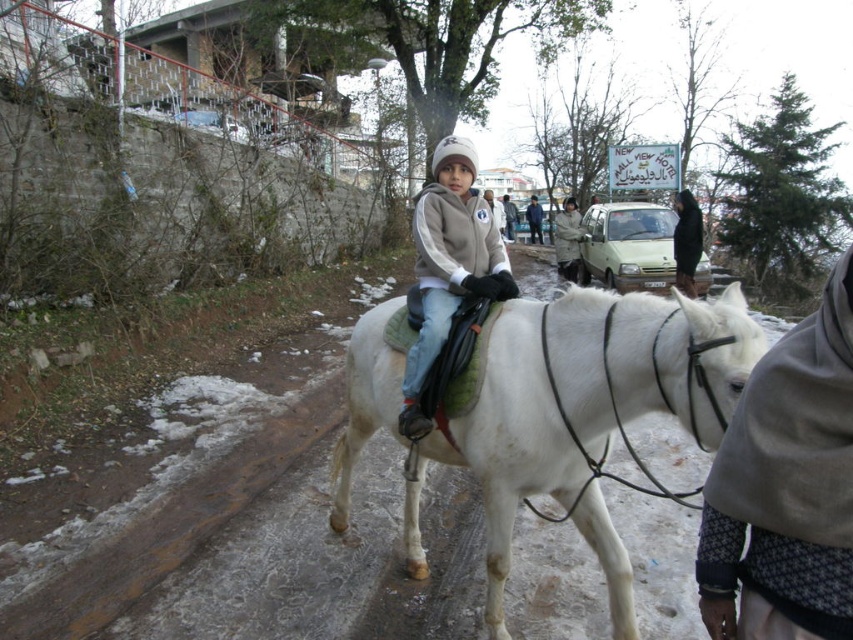
Can you confirm if white matte horse at center is positioned below black fabric bag at center?

Yes, white matte horse at center is below black fabric bag at center.

Which of these two, white matte horse at center or black fabric bag at center, stands shorter?

white matte horse at center is shorter.

Locate an element on the screen. Image resolution: width=853 pixels, height=640 pixels. white matte horse at center is located at coordinates (582, 413).

Can you confirm if blue denim jacket at center is positioned to the right of light gray woolen sweater at center?

Indeed, blue denim jacket at center is positioned on the right side of light gray woolen sweater at center.

Which is below, blue denim jacket at center or light gray woolen sweater at center?

light gray woolen sweater at center is lower down.

Does point (543, 241) come farther from viewer compared to point (496, 211)?

Yes, it is.

At what (x,y) coordinates should I click in order to perform the action: click on blue denim jacket at center. Please return your answer as a coordinate pair (x, y). This screenshot has width=853, height=640. Looking at the image, I should click on (534, 220).

Which is below, light brown leather jacket at center or blue denim jacket at center?

light brown leather jacket at center is below.

Looking at this image, can you confirm if light brown leather jacket at center is smaller than blue denim jacket at center?

No.

Describe the element at coordinates (567, 241) in the screenshot. I see `light brown leather jacket at center` at that location.

The image size is (853, 640). Identify the location of light brown leather jacket at center. (567, 241).